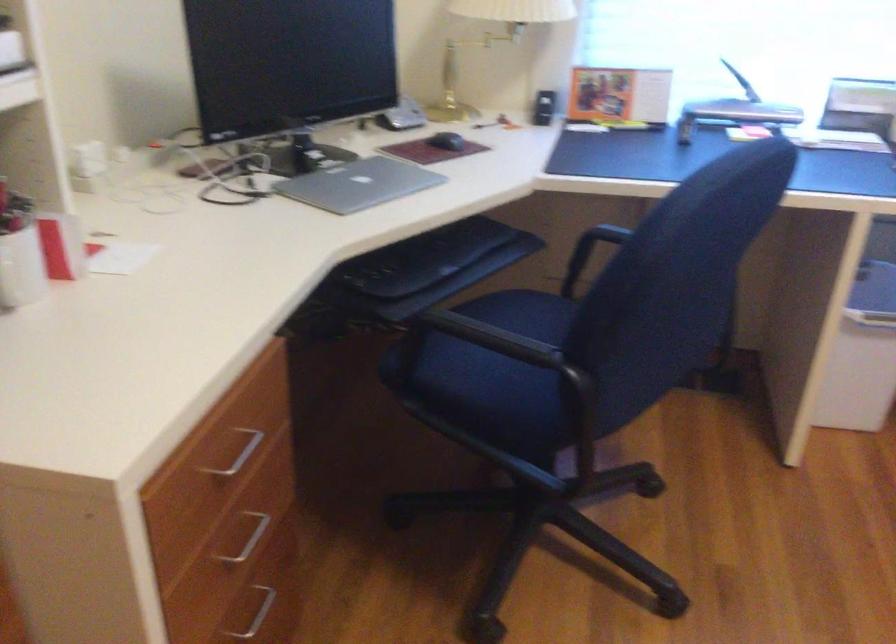
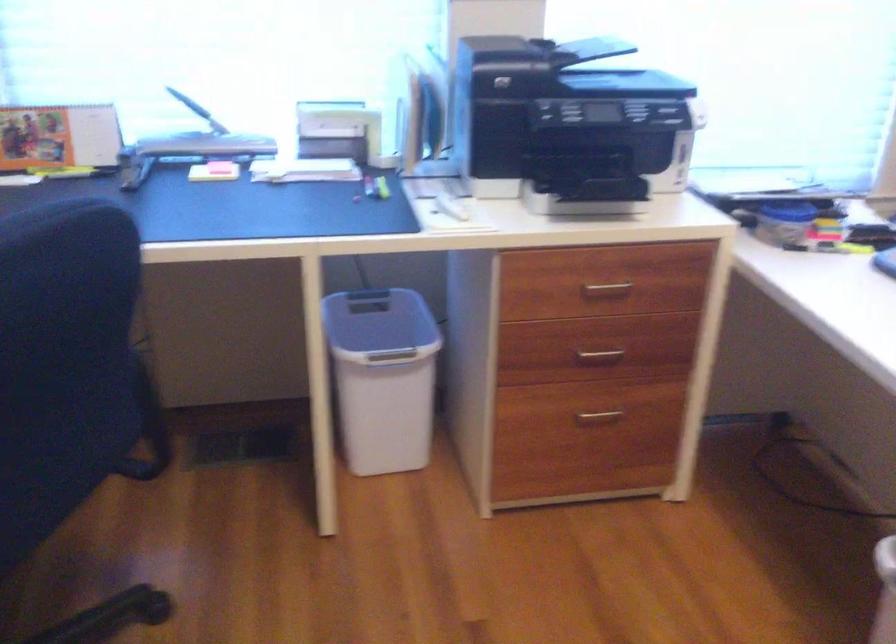
Question: Based on the continuous images, in which direction is the camera rotating? Reply with the corresponding letter.

Choices:
 (A) Left
 (B) Right
 (C) Up
 (D) Down

Answer: (B)